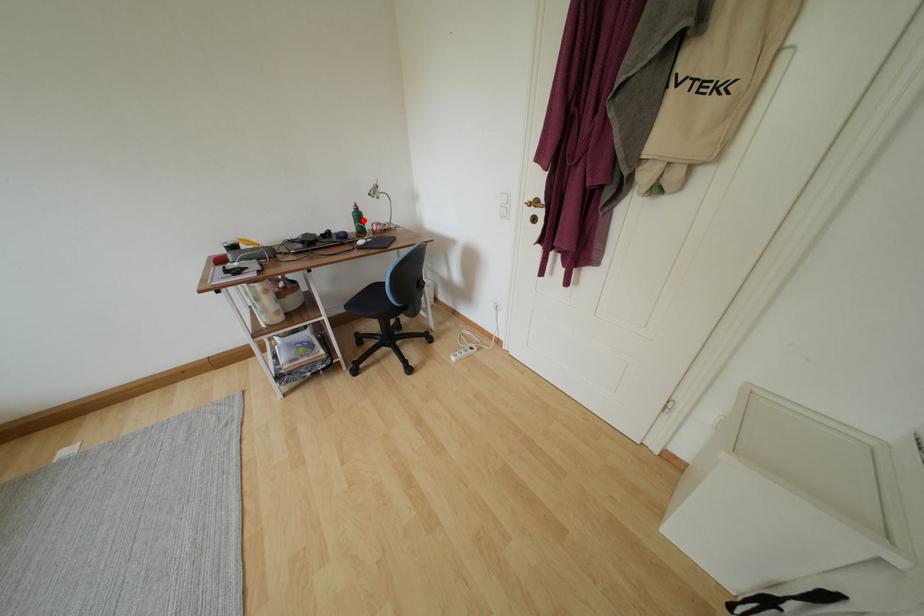
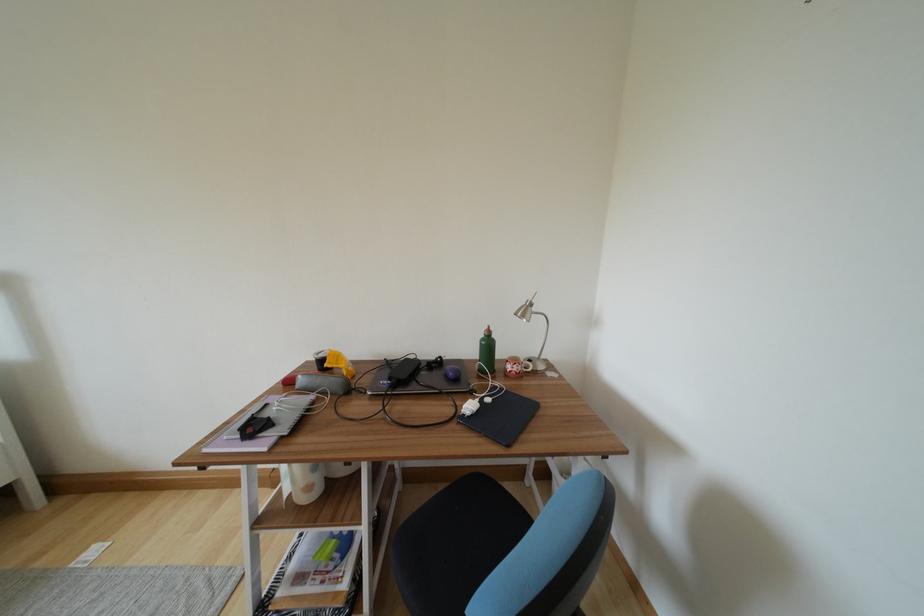
In the second image, find the point that corresponds to the highlighted location in the first image.

(493, 349)